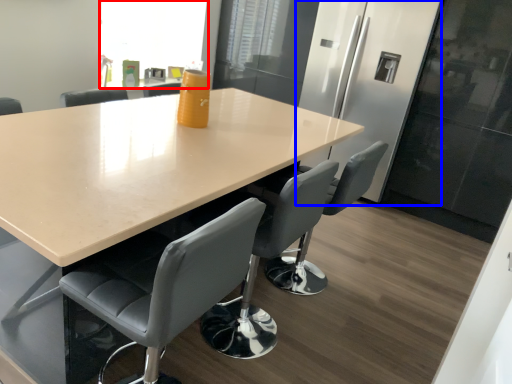
Question: Which of the following is the closest to the observer, window screen (highlighted by a red box) or fridge (highlighted by a blue box)?

Choices:
 (A) window screen
 (B) fridge

Answer: (B)